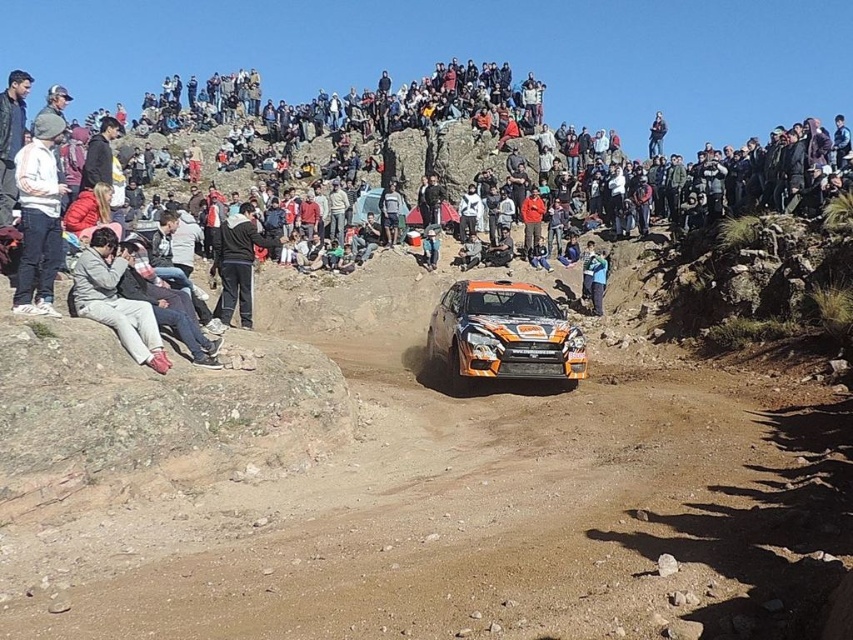
You are a photographer at the rally car event. You want to capture a photo of the rally car while standing at point (138, 316). However, there is another photographer already at point (454, 332). Will your position block their view of the rally car?

Point (454, 332) is behind point (138, 316), so standing at point (138, 316) would block the view of the photographer at point (454, 332).